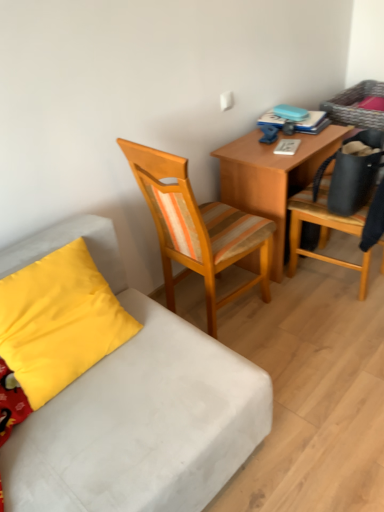
At what (x,y) coordinates should I click in order to perform the action: click on free point below woodenchair at center, the first chair positioned from the left (from a real-world perspective). Please return your answer as a coordinate pair (x, y). Looking at the image, I should click on (230, 310).